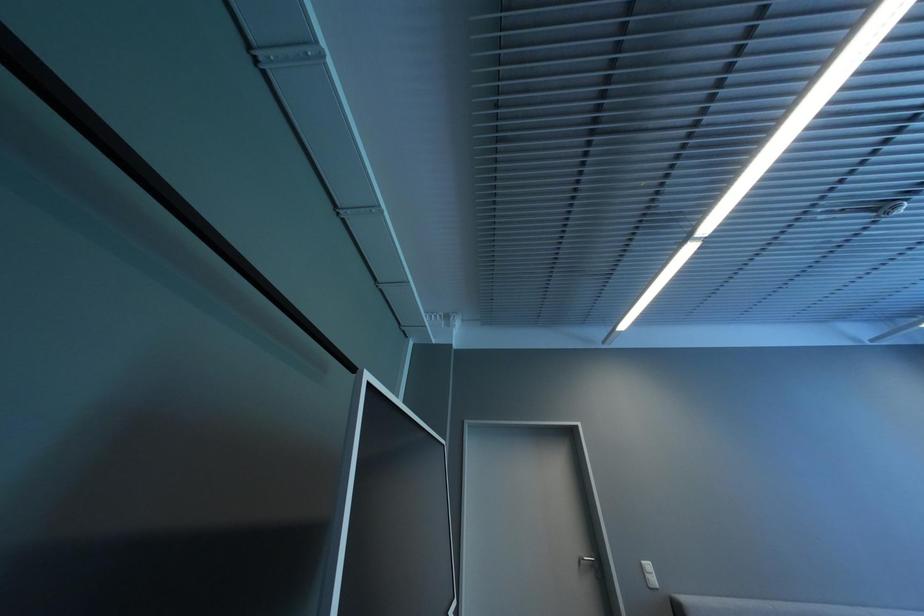
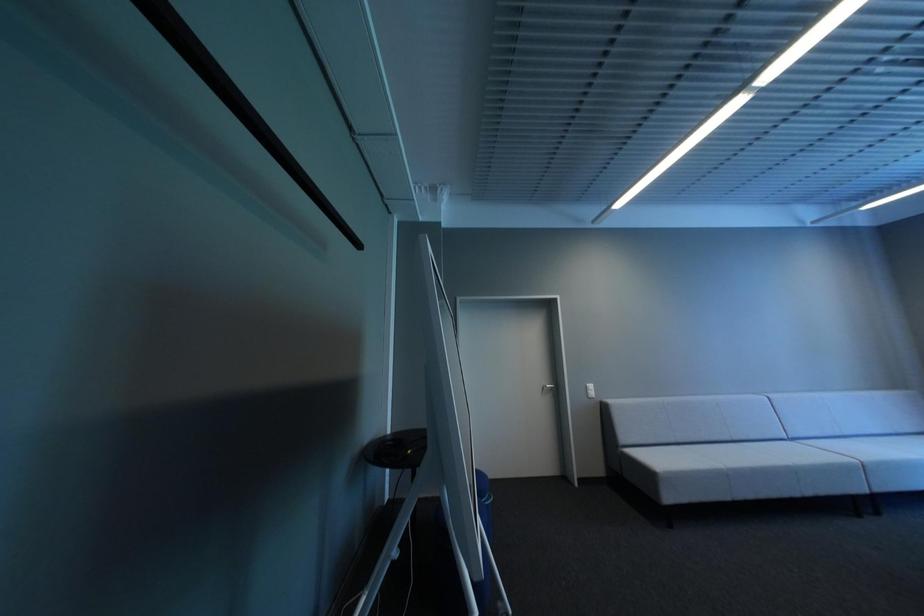
Question: The images are taken continuously from a first-person perspective. In which direction are you moving?

Choices:
 (A) Left
 (B) Right
 (C) Forward
 (D) Backward

Answer: (A)